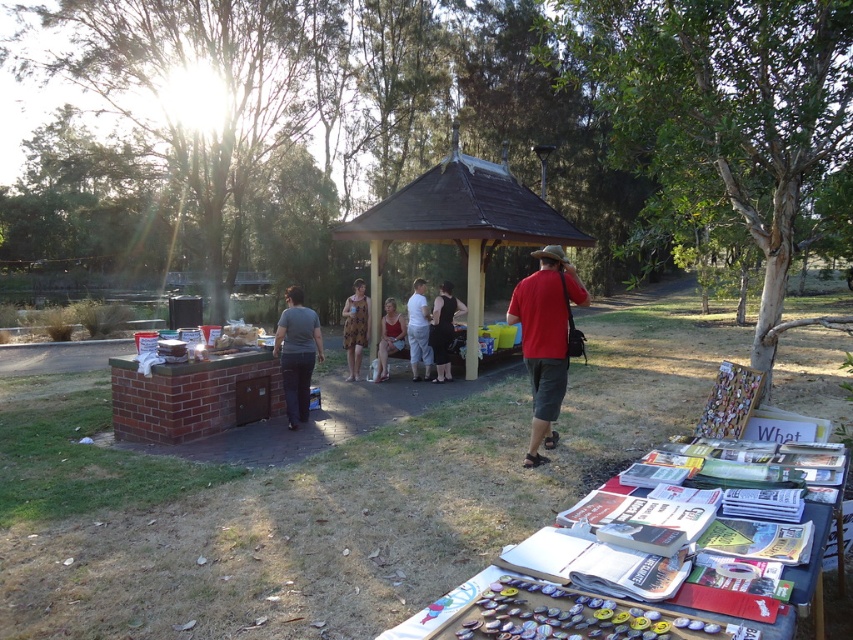
Is point (439, 188) more distant than point (415, 364)?

Yes, it is behind point (415, 364).

Does wooden gazebo at center appear under white cotton shirt at center?

Incorrect, wooden gazebo at center is not positioned below white cotton shirt at center.

You are a GUI agent. You are given a task and a screenshot of the screen. Output one action in this format:
    pyautogui.click(x=<x>, y=<y>)
    Task: Click on the wooden gazebo at center
    
    Given the screenshot: What is the action you would take?
    pyautogui.click(x=461, y=224)

In order to click on wooden gazebo at center in this screenshot , I will do `click(461, 224)`.

Does point (566, 280) come in front of point (289, 397)?

Yes.

Can you confirm if red matte shirt at center is taller than gray cotton shirt at center?

Yes, red matte shirt at center is taller than gray cotton shirt at center.

Does point (527, 362) come farther from viewer compared to point (287, 289)?

No, (527, 362) is closer to viewer.

Identify the location of red matte shirt at center. This screenshot has height=640, width=853. (544, 339).

Is point (476, 369) positioned in front of point (444, 372)?

No, (476, 369) is behind (444, 372).

Looking at this image, between wooden gazebo at center and black smooth dress at center, which one has less height?

wooden gazebo at center is shorter.

The height and width of the screenshot is (640, 853). In order to click on wooden gazebo at center in this screenshot , I will do `click(461, 224)`.

Find the location of a particular element. Image resolution: width=853 pixels, height=640 pixels. wooden gazebo at center is located at coordinates (461, 224).